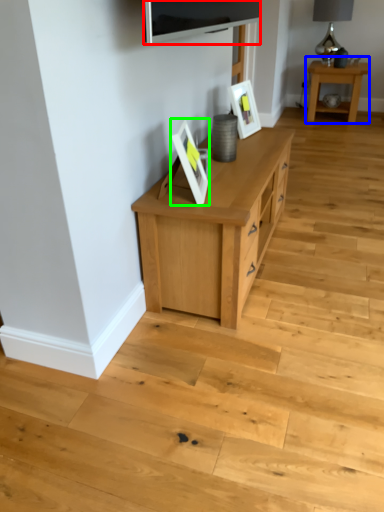
Question: Considering the real-world distances, which object is farthest from television (highlighted by a red box)? table (highlighted by a blue box) or picture frame (highlighted by a green box)?

Choices:
 (A) table
 (B) picture frame

Answer: (A)